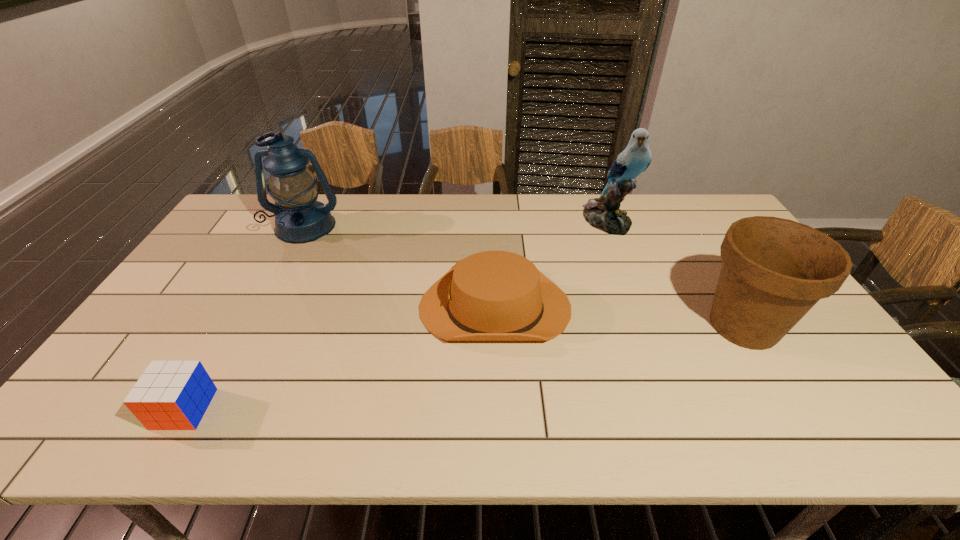
Where is `vacant area that lies between the cowboy hat and the parakeet`? Image resolution: width=960 pixels, height=540 pixels. vacant area that lies between the cowboy hat and the parakeet is located at coordinates (551, 264).

Locate an element on the screen. free space between the lantern and the fourth object from left to right is located at coordinates (456, 224).

Identify the location of object that is the second closest to the rightmost object. (493, 295).

Locate an element on the screen. This screenshot has height=540, width=960. the third closest object to the nearest object is located at coordinates (603, 213).

Locate an element on the screen. free space that satisfies the following two spatial constraints: 1. on the front-facing side of the third object from right to left; 2. on the right side of the flowerpot is located at coordinates (495, 326).